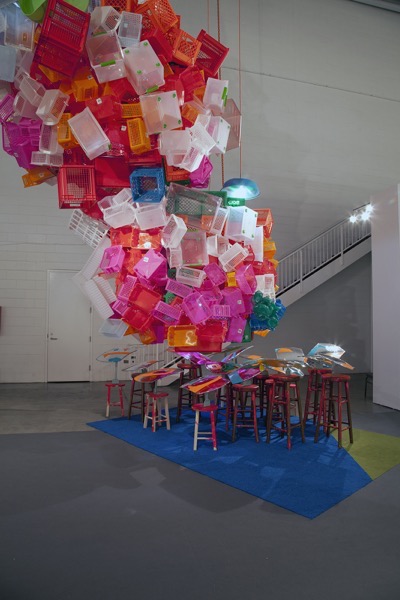
The image size is (400, 600). Find the location of `brown stools with pink/red paint`. brown stools with pink/red paint is located at coordinates (340, 403), (308, 391), (288, 406), (232, 417), (263, 385).